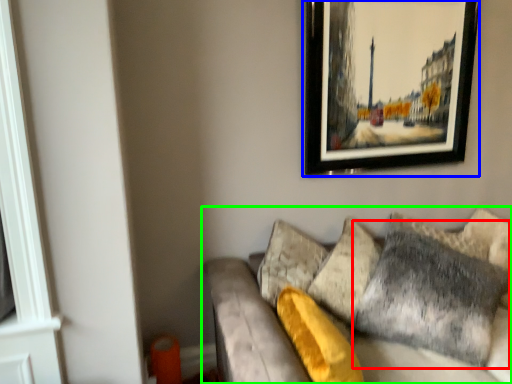
Question: Considering the real-world distances, which object is farthest from pillow (highlighted by a red box)? picture frame (highlighted by a blue box) or studio couch (highlighted by a green box)?

Choices:
 (A) picture frame
 (B) studio couch

Answer: (A)